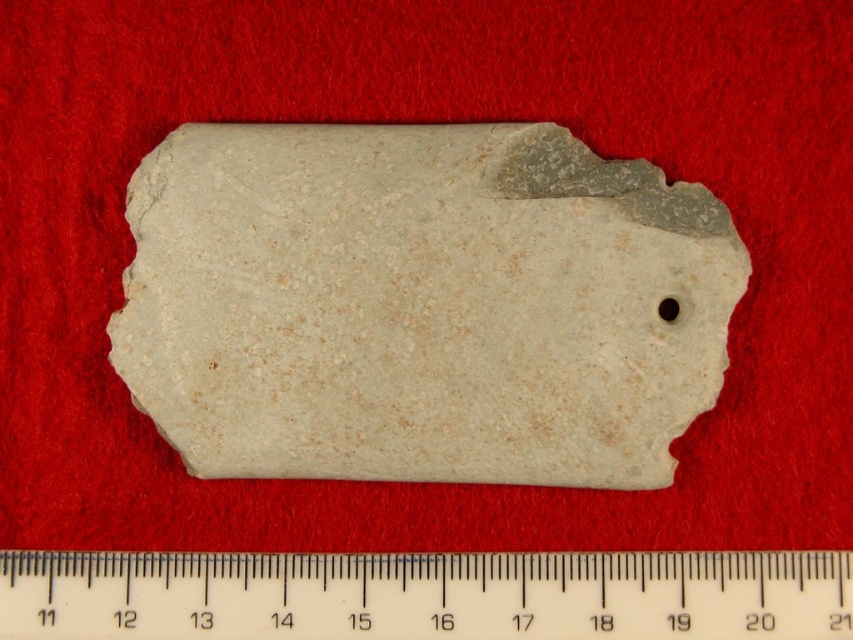
Question: Which point is farther to the camera?

Choices:
 (A) (27, 604)
 (B) (572, 344)

Answer: (B)

Question: Does white stone at center have a lesser width compared to white plastic ruler at bottom?

Choices:
 (A) yes
 (B) no

Answer: (A)

Question: Which point is farther from the camera taking this photo?

Choices:
 (A) (144, 586)
 (B) (671, 260)

Answer: (A)

Question: Does white stone at center have a larger size compared to white plastic ruler at bottom?

Choices:
 (A) no
 (B) yes

Answer: (B)

Question: Observing the image, what is the correct spatial positioning of white stone at center in reference to white plastic ruler at bottom?

Choices:
 (A) above
 (B) below

Answer: (A)

Question: Which point is farther to the camera?

Choices:
 (A) (675, 573)
 (B) (699, 230)

Answer: (A)